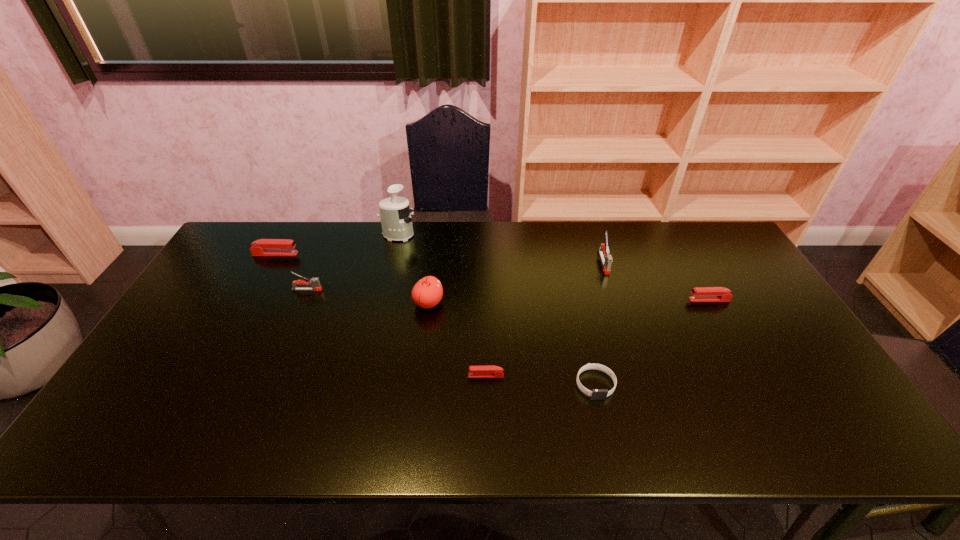
Where is `the second nearest stapler`? The width and height of the screenshot is (960, 540). the second nearest stapler is located at coordinates (699, 294).

At what (x,y) coordinates should I click in order to perform the action: click on the rightmost object. Please return your answer as a coordinate pair (x, y). The height and width of the screenshot is (540, 960). Looking at the image, I should click on (699, 294).

At what (x,y) coordinates should I click in order to perform the action: click on wristband. Please return your answer as a coordinate pair (x, y). Image resolution: width=960 pixels, height=540 pixels. Looking at the image, I should click on (596, 394).

The image size is (960, 540). What are the coordinates of `the third stapler from right to left` in the screenshot? It's located at (490, 371).

Find the location of `the smallest red stapler`. the smallest red stapler is located at coordinates (490, 371).

At what (x,y) coordinates should I click in order to perform the action: click on free space located 0.330m on the right of the farthest object. Please return your answer as a coordinate pair (x, y). Image resolution: width=960 pixels, height=540 pixels. Looking at the image, I should click on (510, 235).

The height and width of the screenshot is (540, 960). In order to click on vacant region located 0.180m on the handle side of the farther gray stapler in this screenshot , I will do coord(620,316).

Find the location of a particular element. The image size is (960, 540). vacant region located 0.280m on the right of the apple is located at coordinates [x=538, y=303].

Locate an element on the screen. The height and width of the screenshot is (540, 960). vacant position located on the handle side of the nearer gray stapler is located at coordinates (423, 289).

This screenshot has height=540, width=960. I want to click on vacant space located on the front-facing side of the leftmost red stapler, so click(x=393, y=254).